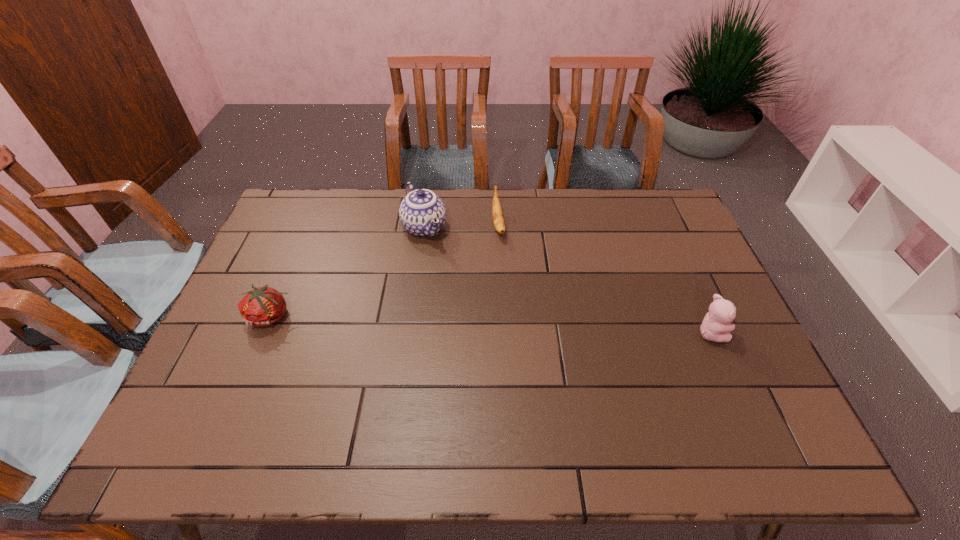
Where is `vacant space that's between the chinaware and the second tallest object`? This screenshot has height=540, width=960. vacant space that's between the chinaware and the second tallest object is located at coordinates (567, 280).

This screenshot has height=540, width=960. What are the coordinates of `object identified as the second closest to the rightmost object` in the screenshot? It's located at (422, 213).

This screenshot has width=960, height=540. I want to click on the third closest object relative to the third object from left to right, so click(263, 306).

Where is `vacant region that satisfies the following two spatial constraints: 1. on the front-facing side of the teddy bear; 2. at the face of the tomato`? vacant region that satisfies the following two spatial constraints: 1. on the front-facing side of the teddy bear; 2. at the face of the tomato is located at coordinates 263,333.

Where is `free region that satisfies the following two spatial constraints: 1. on the front-facing side of the rightmost object; 2. at the face of the leftmost object`? The image size is (960, 540). free region that satisfies the following two spatial constraints: 1. on the front-facing side of the rightmost object; 2. at the face of the leftmost object is located at coordinates (263, 333).

You are a GUI agent. You are given a task and a screenshot of the screen. Output one action in this format:
    pyautogui.click(x=<x>, y=<y>)
    Task: Click on the vacant point that satisfies the following two spatial constraints: 1. on the front side of the third shortest object; 2. at the face of the third object from right to left
    The width and height of the screenshot is (960, 540).
    Given the screenshot: What is the action you would take?
    pyautogui.click(x=410, y=333)

This screenshot has width=960, height=540. Identify the location of free space in the image that satisfies the following two spatial constraints: 1. on the front side of the chinaware; 2. at the face of the teddy bear. (410, 333).

The width and height of the screenshot is (960, 540). What are the coordinates of `vacant position in the image that satisfies the following two spatial constraints: 1. on the front-facing side of the leftmost object; 2. at the face of the third shortest object` in the screenshot? It's located at [263, 333].

The height and width of the screenshot is (540, 960). Identify the location of free space that satisfies the following two spatial constraints: 1. on the back side of the banana; 2. on the left side of the second object from left to right. (424, 225).